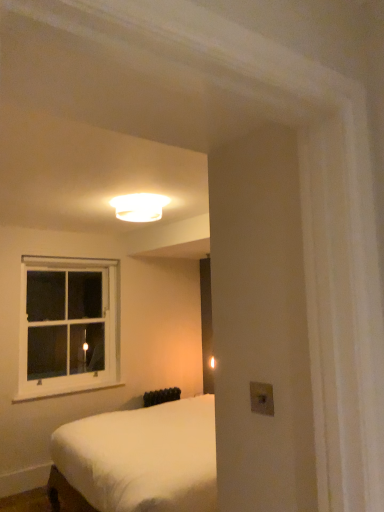
Image resolution: width=384 pixels, height=512 pixels. Identify the location of empty space that is ontop of white painted wood at lower left (from a real-world perspective). (64, 383).